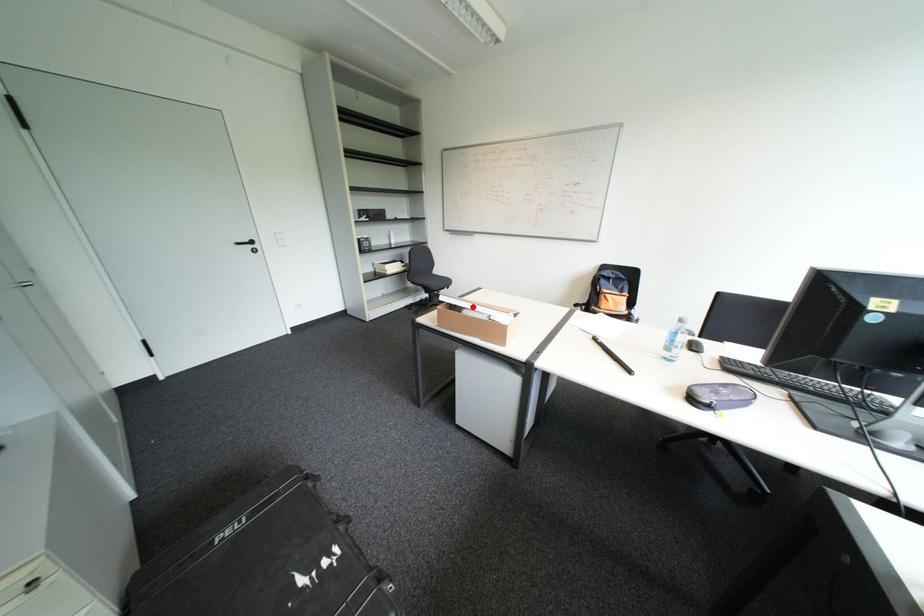
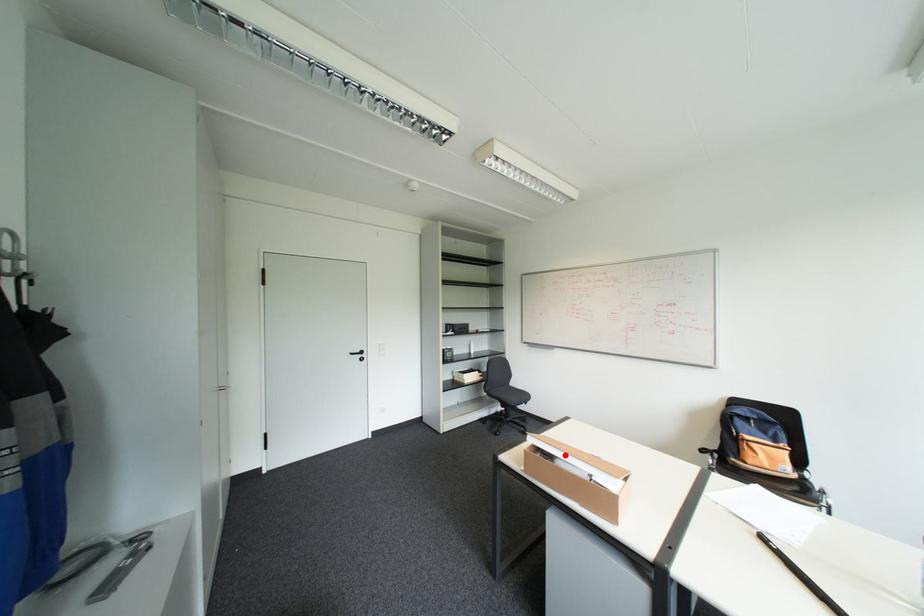
I am providing you with two images of the same scene from different viewpoints. A red point is marked on the first image and another point is marked on the second image. Is the marked point in image1 the same physical position as the marked point in image2?

Yes